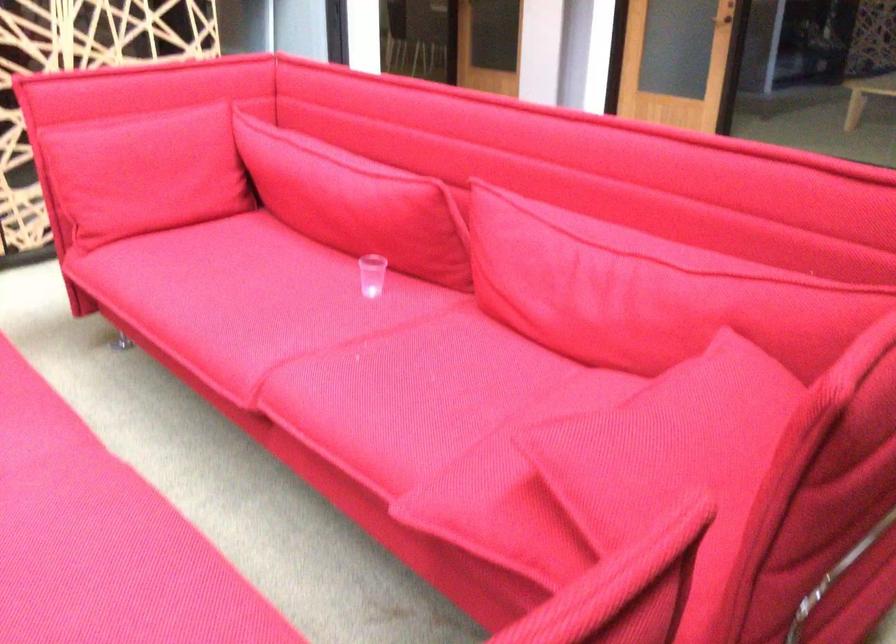
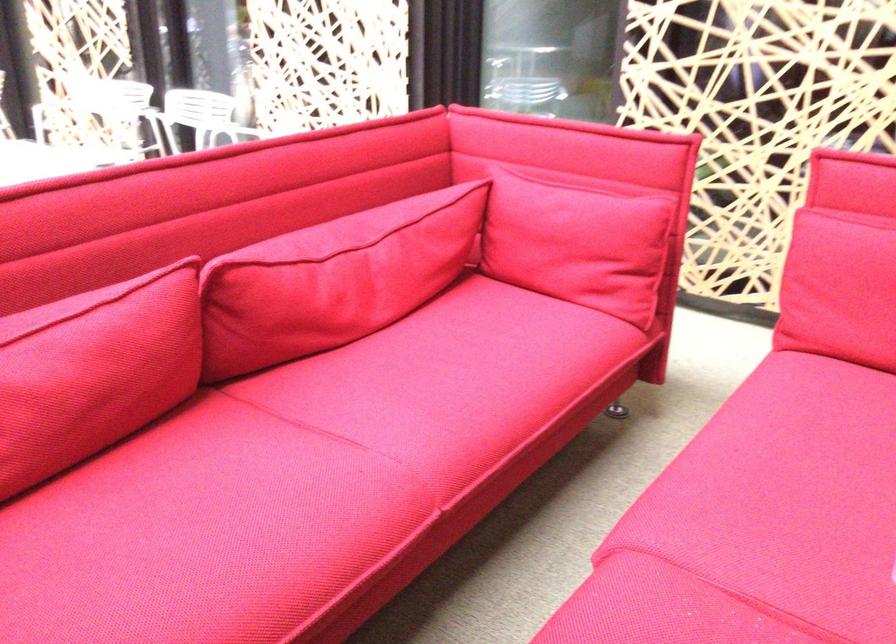
In the second image, find the point that corresponds to pixel 311 321 in the first image.

(759, 522)